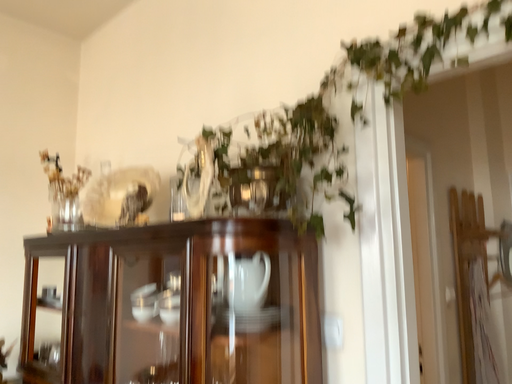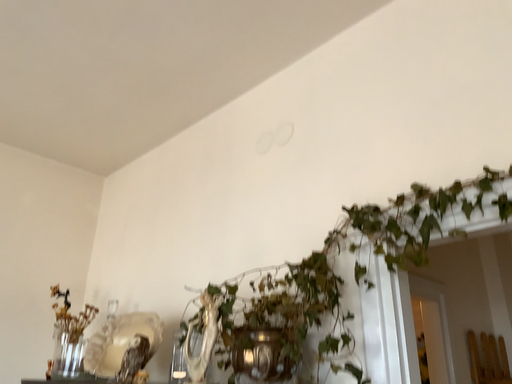
Question: How did the camera likely rotate when shooting the video?

Choices:
 (A) rotated downward
 (B) rotated upward

Answer: (B)